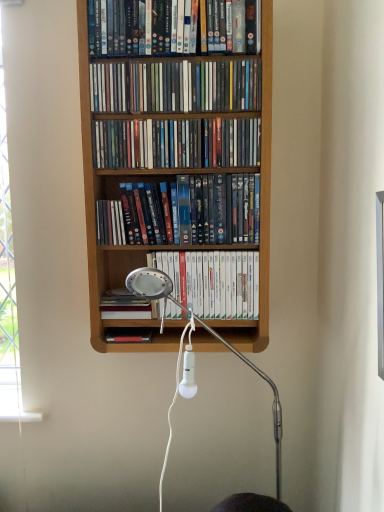
Question: From a real-world perspective, is matte plastic dvds at upper center, which appears as the 1th book when viewed from the top, physically located above or below hardcover book at center, which appears as the 1th book when ordered from the bottom?

Choices:
 (A) below
 (B) above

Answer: (B)

Question: Is matte plastic dvds at upper center, which appears as the 1th book when viewed from the top, to the left or to the right of hardcover book at center, which appears as the 1th book when ordered from the bottom, in the image?

Choices:
 (A) left
 (B) right

Answer: (B)

Question: Which is farther from the white plastic lamp at center?

Choices:
 (A) wooden shelf at upper center, placed as the second book when sorted from top to bottom
 (B) matte plastic dvds at center, positioned as the 4th book in bottom-to-top order
 (C) white matte book at center, acting as the second book starting from the bottom
 (D) hardcover book at center, which appears as the 1th book when ordered from the bottom
 (E) matte black dvds at center, which is the 4th book from top to bottom

Answer: (A)

Question: Based on their relative distances, which object is nearer to the white matte book at center, the fifth book viewed from the top?

Choices:
 (A) wooden shelf at upper center, the 5th book ordered from the bottom
 (B) matte plastic dvds at upper center, which appears as the 1th book when viewed from the top
 (C) hardcover book at center, the sixth book from the top
 (D) matte plastic dvds at center, acting as the third book starting from the top
 (E) matte black dvds at center, which ranks as the third book in bottom-to-top order

Answer: (E)